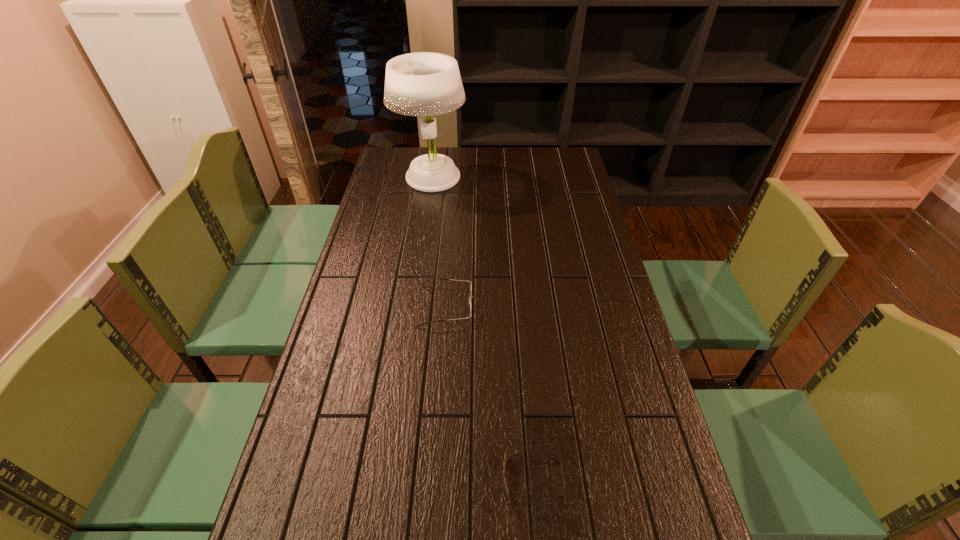
I want to click on free space between the shortest object and the second farthest object, so 489,393.

Identify the location of empty space between the second shortest object and the nearest object. The image size is (960, 540). (489, 393).

Identify the location of object that ranks as the closest to the shortest object. (471, 296).

The width and height of the screenshot is (960, 540). I want to click on object identified as the second closest to the farthest object, so click(x=505, y=457).